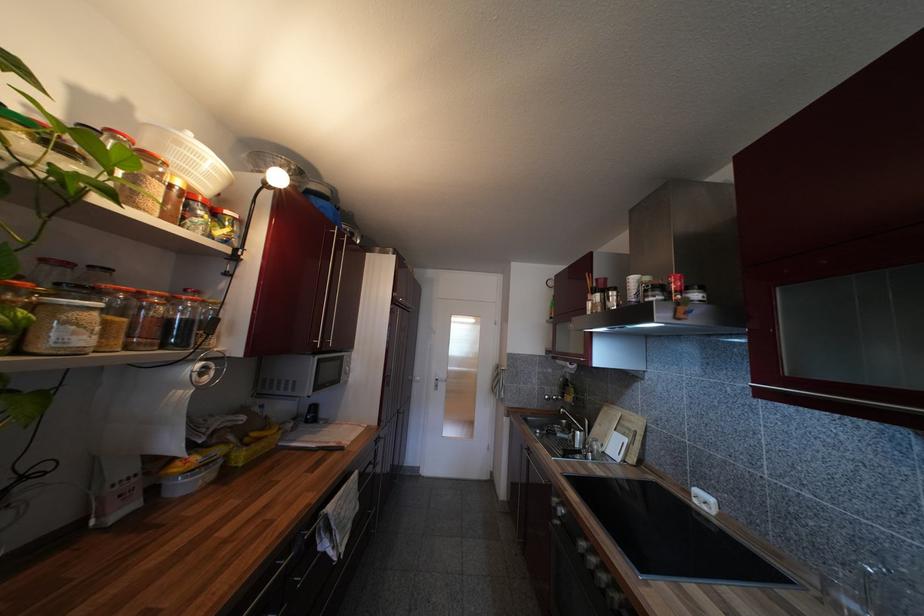
At what (x,y) coordinates should I click in order to perform the action: click on dispenser pump. Please return your answer as a coordinate pair (x, y). This screenshot has height=616, width=924. Looking at the image, I should click on (114, 488).